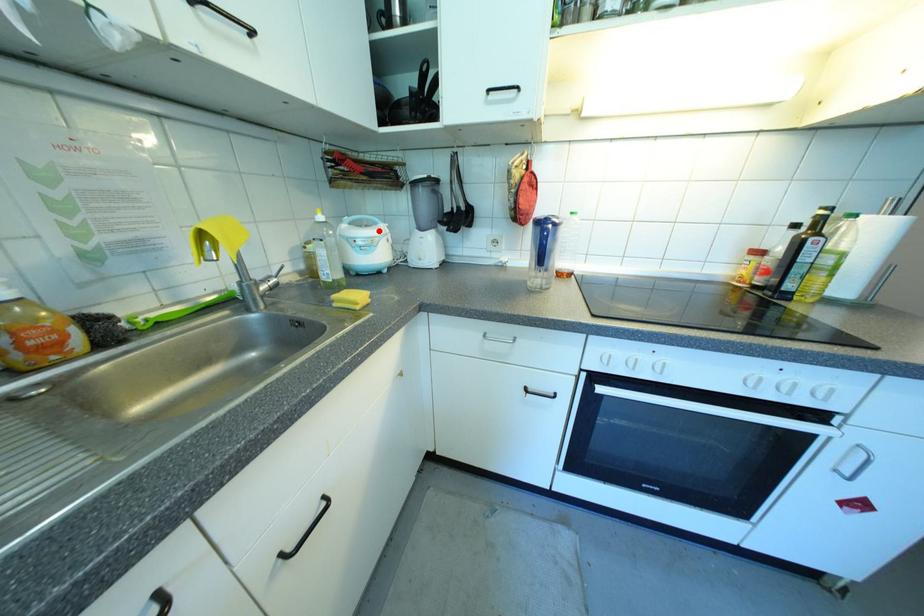
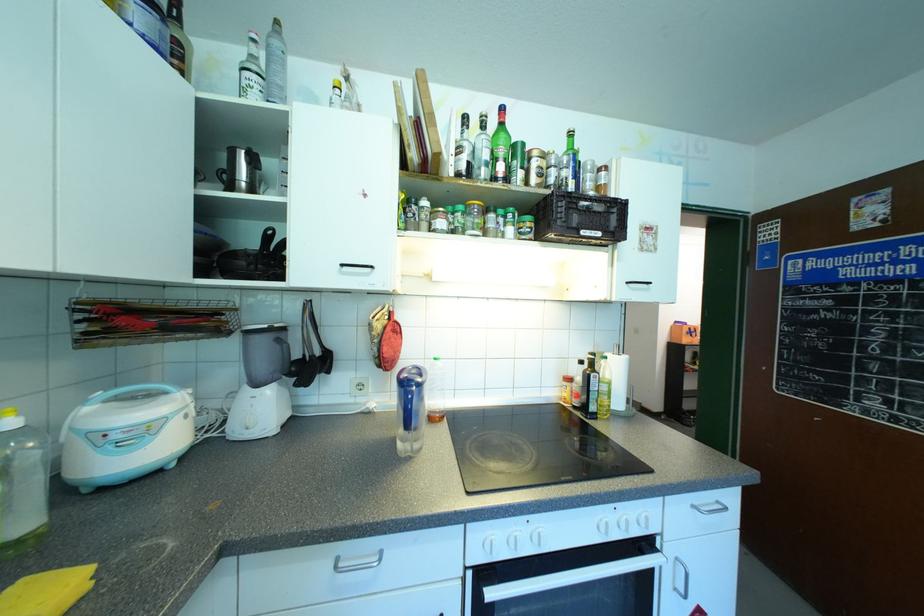
Find the pixel in the second image that matches the highlighted location in the first image.

(172, 403)